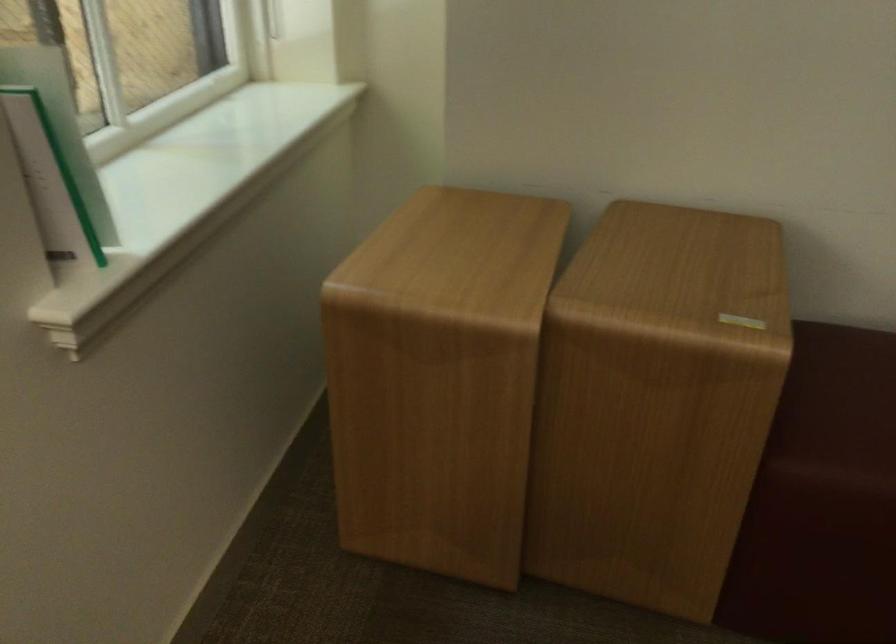
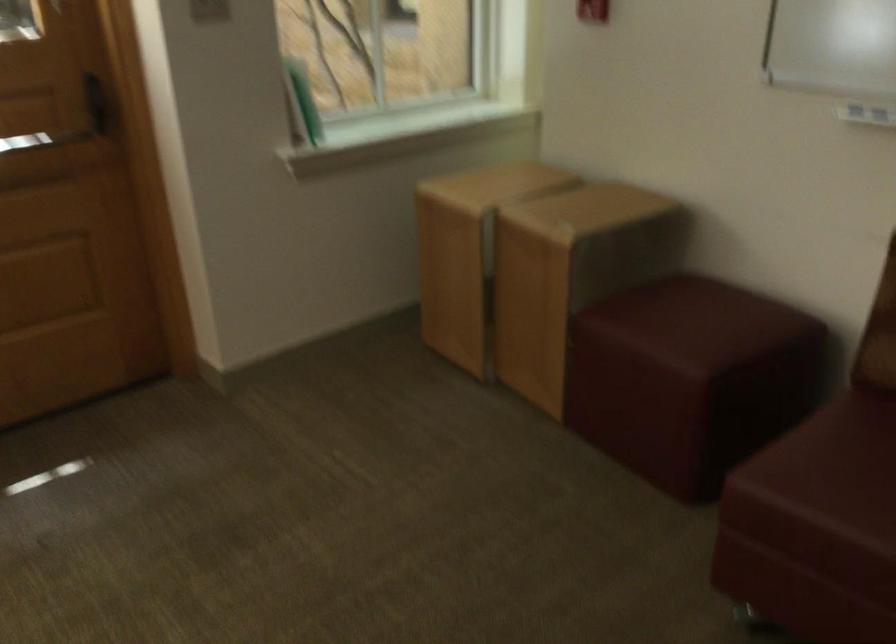
Locate, in the second image, the point that corresponds to (x=759, y=399) in the first image.

(570, 272)